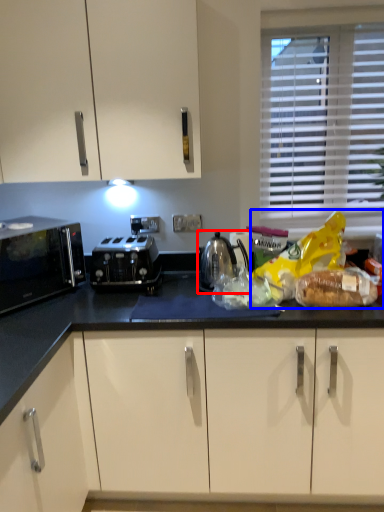
Question: Among these objects, which one is farthest to the camera, kitchen appliance (highlighted by a red box) or food (highlighted by a blue box)?

Choices:
 (A) kitchen appliance
 (B) food

Answer: (A)